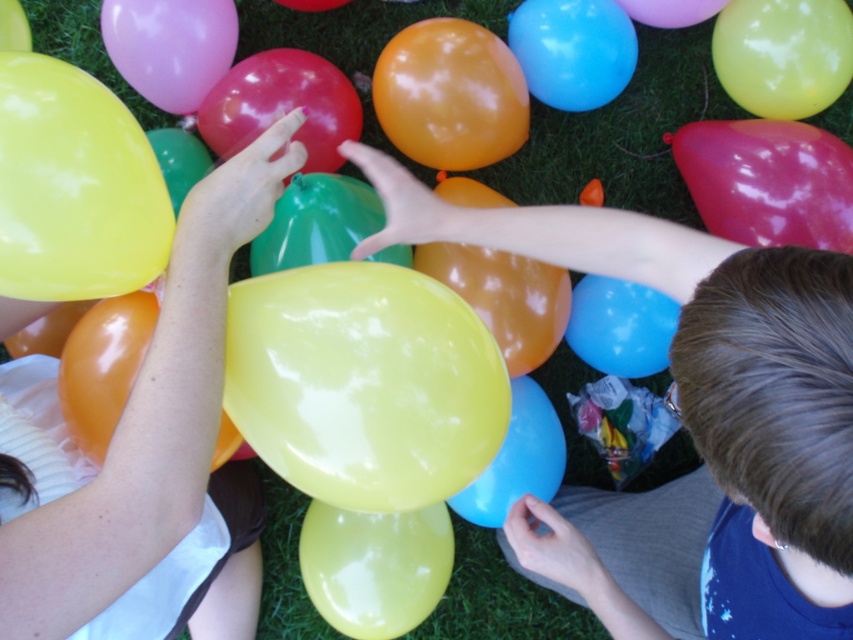
Based on the photo, can you confirm if smooth yellow balloon at upper left is shorter than matte yellow balloon at center?

No, smooth yellow balloon at upper left is not shorter than matte yellow balloon at center.

Between point (102, 504) and point (735, 16), which one is positioned behind?

The point (735, 16) is behind.

Between point (30, 372) and point (833, 84), which one is positioned in front?

Positioned in front is point (30, 372).

Find the location of `smooth yellow balloon at upper left`. smooth yellow balloon at upper left is located at coordinates (144, 454).

Measure the distance from smooth yellow balloon at center to smooth yellow balloon at upper left.

The distance of smooth yellow balloon at center from smooth yellow balloon at upper left is 21.73 inches.

Is point (799, 499) closer to camera compared to point (224, 541)?

Yes, point (799, 499) is closer to viewer.

Is point (753, 390) behind point (113, 563)?

No, it is in front of (113, 563).

You are a GUI agent. You are given a task and a screenshot of the screen. Output one action in this format:
    pyautogui.click(x=<x>, y=<y>)
    Task: Click on the smooth yellow balloon at center
    
    Given the screenshot: What is the action you would take?
    pyautogui.click(x=706, y=353)

Who is more distant from viewer, (498,218) or (807,99)?

Point (807,99)

Can you confirm if smooth yellow balloon at center is positioned to the left of matte yellow balloon at center?

Correct, you'll find smooth yellow balloon at center to the left of matte yellow balloon at center.

Is point (778, 260) positioned behind point (743, 99)?

No, it is in front of (743, 99).

In order to click on smooth yellow balloon at center in this screenshot , I will do `click(706, 353)`.